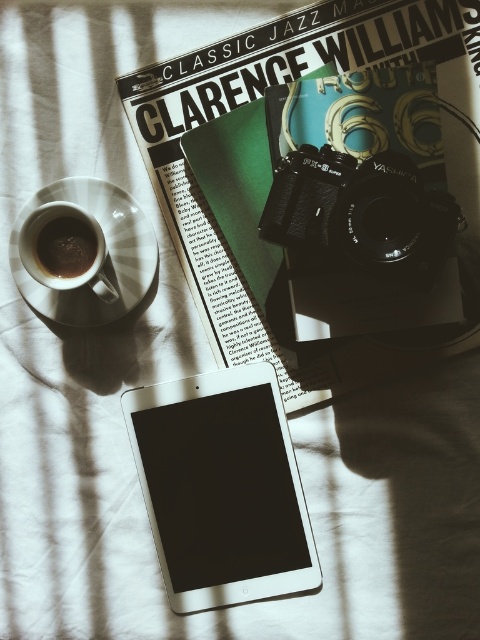
Question: Among these objects, which one is nearest to the camera?

Choices:
 (A) black matte camera at center
 (B) silver metallic tablet at center

Answer: (A)

Question: Is matte paper magazine at upper center in front of dark matte coffee cup at upper left?

Choices:
 (A) yes
 (B) no

Answer: (A)

Question: Is matte paper magazine at upper center above dark matte coffee cup at upper left?

Choices:
 (A) yes
 (B) no

Answer: (A)

Question: Estimate the real-world distances between objects in this image. Which object is farther from the silver metallic tablet at center?

Choices:
 (A) black matte camera at center
 (B) dark matte coffee cup at upper left
 (C) matte paper magazine at upper center

Answer: (B)

Question: Among these objects, which one is nearest to the camera?

Choices:
 (A) dark matte coffee cup at upper left
 (B) black matte camera at center

Answer: (B)

Question: Does black matte camera at center appear on the right side of dark matte coffee cup at upper left?

Choices:
 (A) no
 (B) yes

Answer: (B)